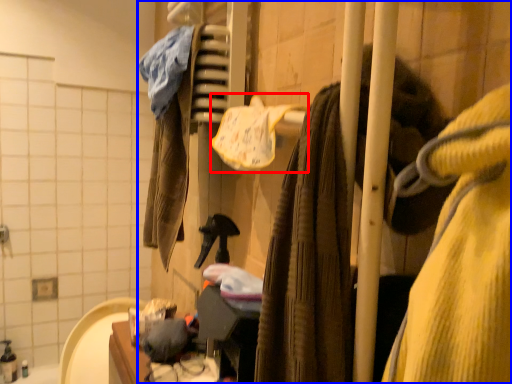
Question: Which object is further to the camera taking this photo, bath towel (highlighted by a red box) or closet (highlighted by a blue box)?

Choices:
 (A) bath towel
 (B) closet

Answer: (A)